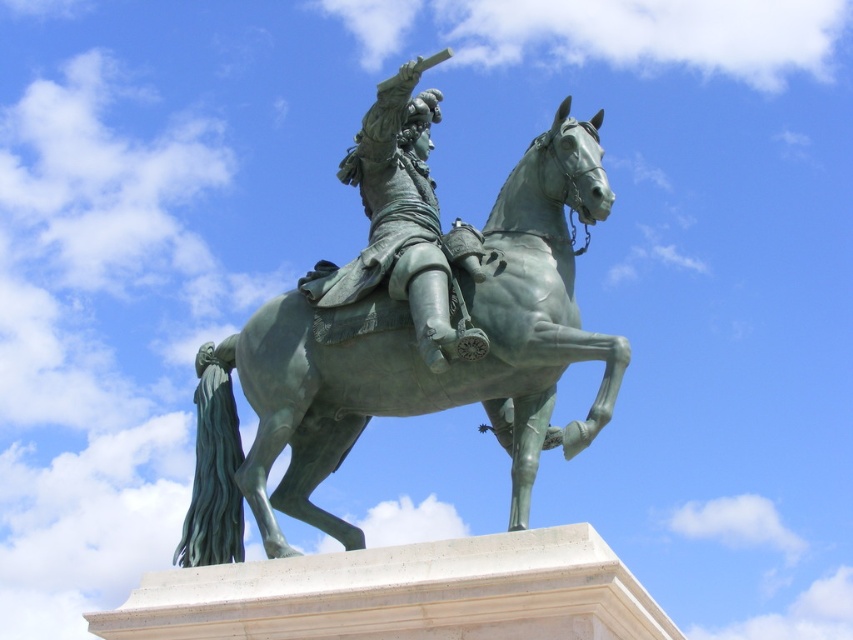
Question: Is green polished bronze statue at center to the left of green polished metal horse at center from the viewer's perspective?

Choices:
 (A) yes
 (B) no

Answer: (B)

Question: Which of the following is the farthest from the observer?

Choices:
 (A) (517, 342)
 (B) (434, 307)

Answer: (B)

Question: Does green polished bronze statue at center have a smaller size compared to green polished metal horse at center?

Choices:
 (A) no
 (B) yes

Answer: (B)

Question: Which object is farther from the camera taking this photo?

Choices:
 (A) green polished bronze statue at center
 (B) green polished metal horse at center

Answer: (B)

Question: Is green polished bronze statue at center bigger than green polished metal horse at center?

Choices:
 (A) no
 (B) yes

Answer: (A)